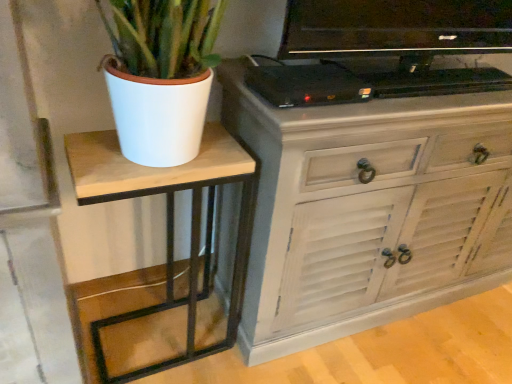
Question: Considering their positions, is wooden table at left located in front of or behind black glossy television at upper center?

Choices:
 (A) behind
 (B) front

Answer: (A)

Question: In terms of width, does wooden table at left look wider or thinner when compared to black glossy television at upper center?

Choices:
 (A) thin
 (B) wide

Answer: (B)

Question: Which is nearer to the black glossy television at upper center?

Choices:
 (A) wooden table at left
 (B) black plastic device at upper center
 (C) distressed white cabinet at center

Answer: (B)

Question: Which of these objects is positioned farthest from the black plastic device at upper center?

Choices:
 (A) black glossy television at upper center
 (B) distressed white cabinet at center
 (C) wooden table at left

Answer: (C)